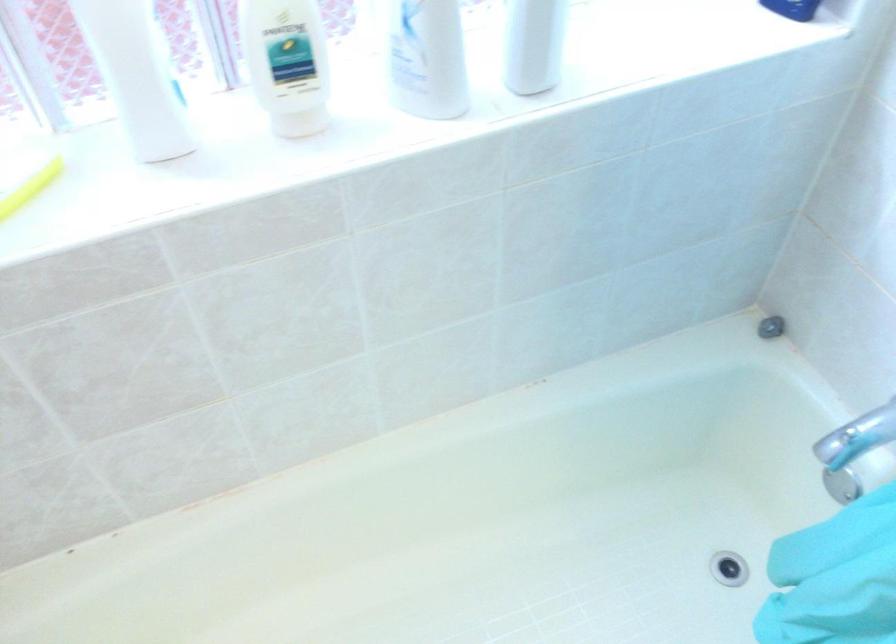
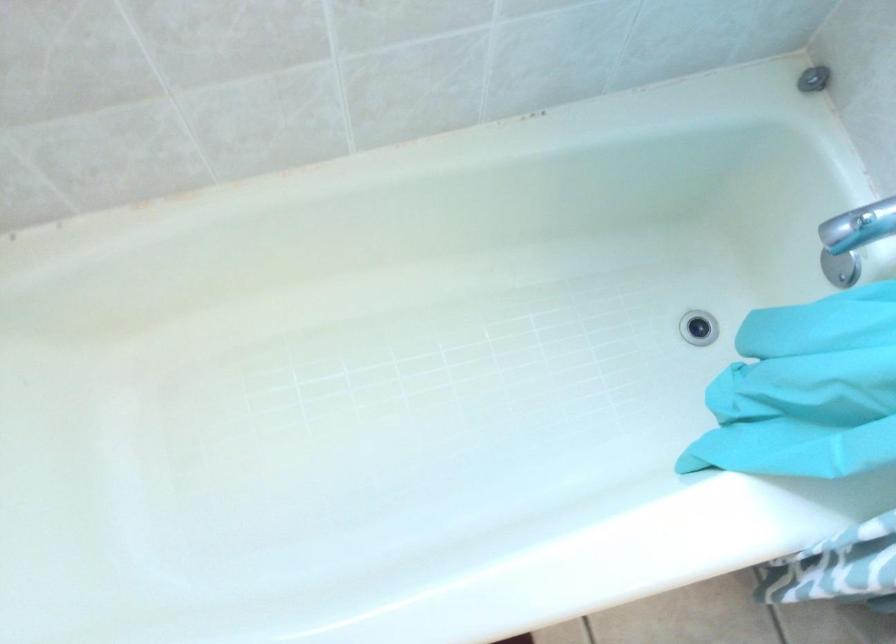
Question: The images are taken continuously from a first-person perspective. In which direction is your viewpoint rotating?

Choices:
 (A) Left
 (B) Right
 (C) Up
 (D) Down

Answer: (D)